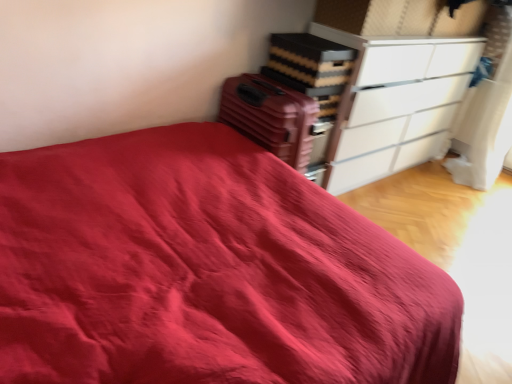
I want to click on matte plastic suitcase at center-right, so click(270, 116).

Describe the element at coordinates (270, 116) in the screenshot. I see `matte plastic suitcase at center-right` at that location.

At what (x,y) coordinates should I click in order to perform the action: click on white glossy chest of drawers at upper right. Please return your answer as a coordinate pair (x, y). Looking at the image, I should click on (395, 103).

What do you see at coordinates (395, 103) in the screenshot? This screenshot has height=384, width=512. I see `white glossy chest of drawers at upper right` at bounding box center [395, 103].

Identify the location of matte plastic suitcase at center-right. (270, 116).

Would you say matte plastic suitcase at center-right is to the left or to the right of white glossy chest of drawers at upper right in the picture?

From the image, it's evident that matte plastic suitcase at center-right is to the left of white glossy chest of drawers at upper right.

Which object is more forward, matte plastic suitcase at center-right or white glossy chest of drawers at upper right?

matte plastic suitcase at center-right is more forward.

Which is in front, point (295, 152) or point (352, 138)?

The point (295, 152) is in front.

From the image's perspective, which object appears higher, matte plastic suitcase at center-right or white glossy chest of drawers at upper right?

white glossy chest of drawers at upper right is shown above in the image.

From a real-world perspective, does matte plastic suitcase at center-right sit lower than white glossy chest of drawers at upper right?

Actually, matte plastic suitcase at center-right is physically above white glossy chest of drawers at upper right in the real world.

In terms of width, does matte plastic suitcase at center-right look wider or thinner when compared to white glossy chest of drawers at upper right?

matte plastic suitcase at center-right is wider than white glossy chest of drawers at upper right.

Is matte plastic suitcase at center-right taller than white glossy chest of drawers at upper right?

No, matte plastic suitcase at center-right is not taller than white glossy chest of drawers at upper right.

Can you confirm if matte plastic suitcase at center-right is bigger than white glossy chest of drawers at upper right?

No.

Is matte plastic suitcase at center-right not inside white glossy chest of drawers at upper right?

Absolutely, matte plastic suitcase at center-right is external to white glossy chest of drawers at upper right.

Is matte plastic suitcase at center-right directly adjacent to white glossy chest of drawers at upper right?

matte plastic suitcase at center-right is not next to white glossy chest of drawers at upper right, and they're not touching.

Is matte plastic suitcase at center-right oriented away from white glossy chest of drawers at upper right?

No, matte plastic suitcase at center-right is not facing away from white glossy chest of drawers at upper right.

Can you tell me how much matte plastic suitcase at center-right and white glossy chest of drawers at upper right differ in facing direction?

The facing directions of matte plastic suitcase at center-right and white glossy chest of drawers at upper right are 0.0297 degrees apart.

How far apart are matte plastic suitcase at center-right and white glossy chest of drawers at upper right?

matte plastic suitcase at center-right and white glossy chest of drawers at upper right are 29.07 inches apart from each other.

Where is `luggage in front of the white glossy chest of drawers at upper right`? This screenshot has width=512, height=384. luggage in front of the white glossy chest of drawers at upper right is located at coordinates (270, 116).

Is white glossy chest of drawers at upper right to the right of matte plastic suitcase at center-right from the viewer's perspective?

Indeed, white glossy chest of drawers at upper right is positioned on the right side of matte plastic suitcase at center-right.

Between white glossy chest of drawers at upper right and matte plastic suitcase at center-right, which one is positioned in front?

Positioned in front is matte plastic suitcase at center-right.

Which is behind, point (434, 75) or point (244, 86)?

The point (434, 75) is farther from the camera.

From the image's perspective, would you say white glossy chest of drawers at upper right is positioned over matte plastic suitcase at center-right?

Yes, from the image's perspective, white glossy chest of drawers at upper right is above matte plastic suitcase at center-right.

From a real-world perspective, is white glossy chest of drawers at upper right on top of matte plastic suitcase at center-right?

Actually, white glossy chest of drawers at upper right is physically below matte plastic suitcase at center-right in the real world.

Is white glossy chest of drawers at upper right wider than matte plastic suitcase at center-right?

No.

Is white glossy chest of drawers at upper right taller or shorter than matte plastic suitcase at center-right?

In the image, white glossy chest of drawers at upper right appears to be taller than matte plastic suitcase at center-right.

Can you confirm if white glossy chest of drawers at upper right is smaller than matte plastic suitcase at center-right?

Actually, white glossy chest of drawers at upper right might be larger than matte plastic suitcase at center-right.

Is white glossy chest of drawers at upper right not inside matte plastic suitcase at center-right?

Yes, white glossy chest of drawers at upper right is located beyond the bounds of matte plastic suitcase at center-right.

Is white glossy chest of drawers at upper right touching matte plastic suitcase at center-right?

No, white glossy chest of drawers at upper right is not touching matte plastic suitcase at center-right.

Is white glossy chest of drawers at upper right positioned with its back to matte plastic suitcase at center-right?

No, white glossy chest of drawers at upper right is not facing the opposite direction of matte plastic suitcase at center-right.

How different are the orientations of white glossy chest of drawers at upper right and matte plastic suitcase at center-right in degrees?

The angular difference between white glossy chest of drawers at upper right and matte plastic suitcase at center-right is 0.0297 degrees.

Measure the distance between white glossy chest of drawers at upper right and matte plastic suitcase at center-right.

They are 29.07 inches apart.

Locate an element on the screen. Image resolution: width=512 pixels, height=384 pixels. luggage on the left of white glossy chest of drawers at upper right is located at coordinates (270, 116).

Image resolution: width=512 pixels, height=384 pixels. I want to click on the chest of drawers that is above the matte plastic suitcase at center-right (from the image's perspective), so click(395, 103).

At what (x,y) coordinates should I click in order to perform the action: click on luggage that appears on the left of white glossy chest of drawers at upper right. Please return your answer as a coordinate pair (x, y). The height and width of the screenshot is (384, 512). Looking at the image, I should click on (270, 116).